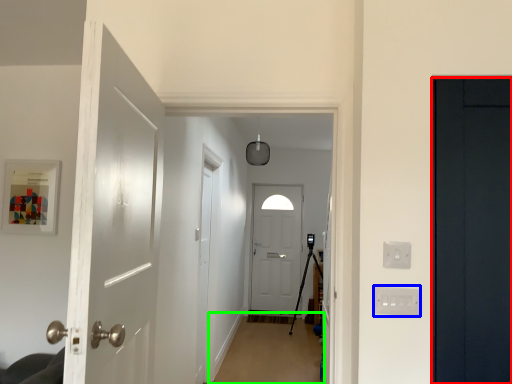
Question: Which object is positioned farthest from door (highlighted by a red box)? Select from electric outlet (highlighted by a blue box) and plain (highlighted by a green box).

Choices:
 (A) electric outlet
 (B) plain

Answer: (B)